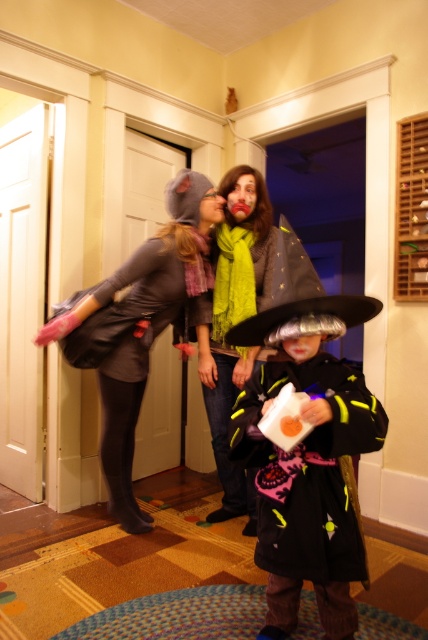
You are a costume designer trying to fit a new accessory onto the matte black costume at center. The accessory requires the costume to be narrower than the shiny silver witch hat at center. Based on the scene, will this accessory fit?

The matte black costume at center is wider than the shiny silver witch hat at center, so the accessory requiring the costume to be narrower will not fit.

You are standing in the hallway and want to place a small gift box at the exact location where the matte gray dress at left is currently positioned. What coordinates should you use to place the gift box?

You should place the gift box at coordinates point (x=137, y=324) where the matte gray dress at left is located.

From the picture: You are a guest at a costume party and notice two attendees wearing the matte black costume at center and the matte gray dress at left. Which costume is shorter in height?

The matte black costume at center is shorter than the matte gray dress at left.